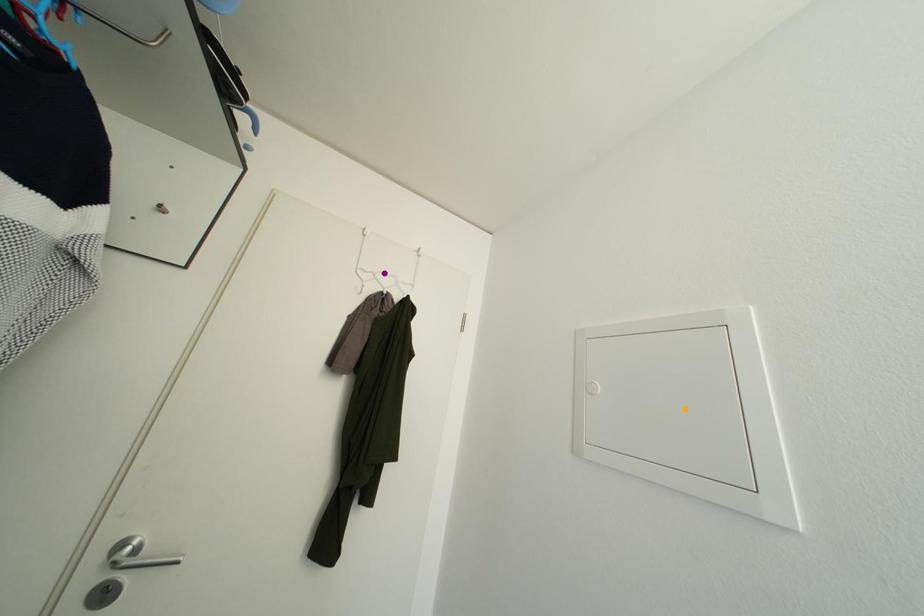
Order these from nearest to farthest:
1. orange point
2. purple point
3. red point

orange point < red point < purple point